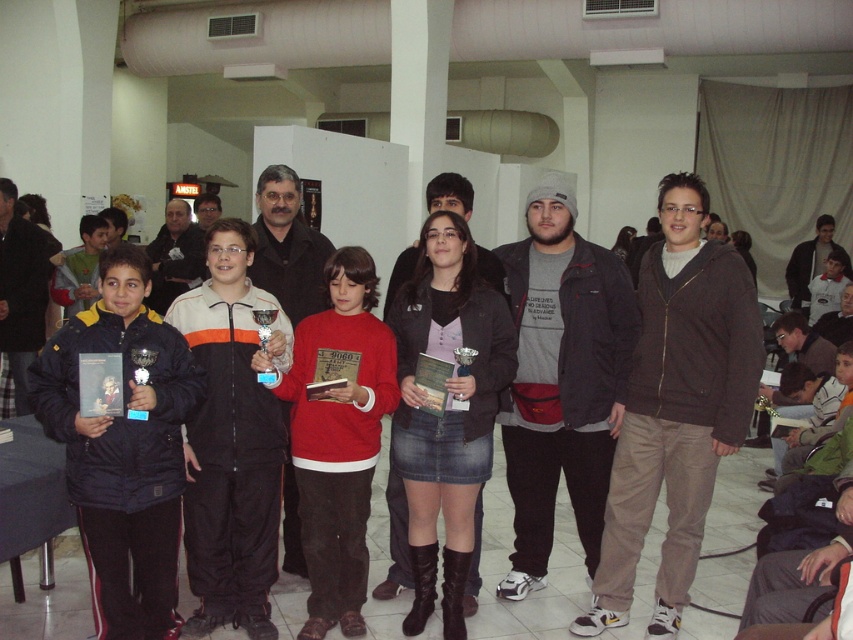
Is black puffy jacket at left bigger than red matte sweater at center?

Yes, black puffy jacket at left is bigger than red matte sweater at center.

Which of these two, black puffy jacket at left or red matte sweater at center, stands shorter?

black puffy jacket at left

Find the location of a particular element. Image resolution: width=853 pixels, height=640 pixels. black puffy jacket at left is located at coordinates (123, 449).

Is point (84, 524) more distant than point (523, 625)?

No, it is in front of (523, 625).

Is point (82, 440) positioned behind point (293, 628)?

No, it is not.

Image resolution: width=853 pixels, height=640 pixels. Find the location of `black puffy jacket at left`. black puffy jacket at left is located at coordinates (123, 449).

Who is lower down, denim skirt at center or red matte sweater at center?

Positioned lower is red matte sweater at center.

From the picture: Is denim skirt at center to the left of red matte sweater at center from the viewer's perspective?

In fact, denim skirt at center is to the right of red matte sweater at center.

Which is behind, point (469, 397) or point (317, 428)?

The point (317, 428) is more distant.

Where is `denim skirt at center`? The image size is (853, 640). denim skirt at center is located at coordinates (445, 410).